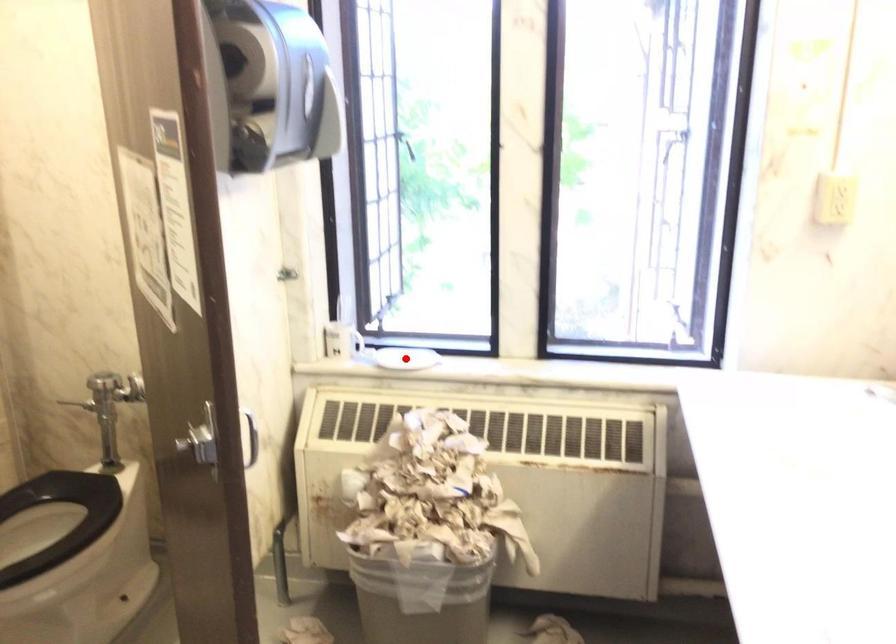
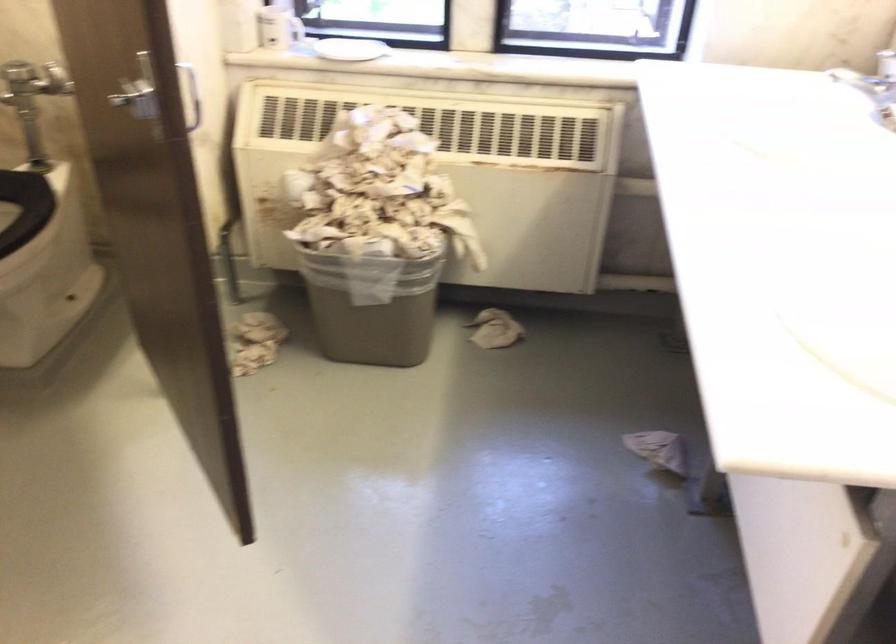
Question: I am providing you with two images of the same scene from different viewpoints. A red point is shown in image1. For the corresponding object point in image2, is it positioned nearer or farther from the camera?

Choices:
 (A) Nearer
 (B) Farther

Answer: (A)